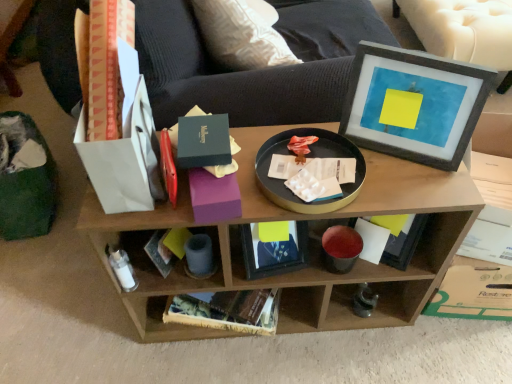
Locate an element on the screen. vacant point above wooden shelf at center (from a real-world perspective) is located at coordinates (321, 175).